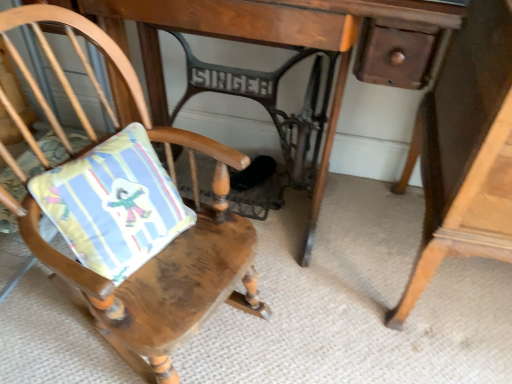
The image size is (512, 384). What are the coordinates of `vacant space to the right of wooden cushioned chair at center` in the screenshot? It's located at (311, 324).